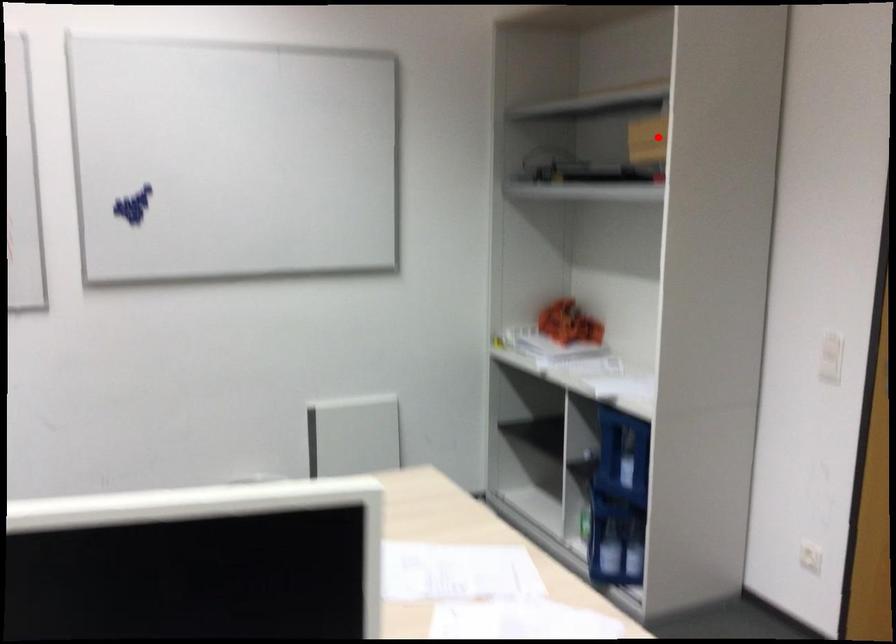
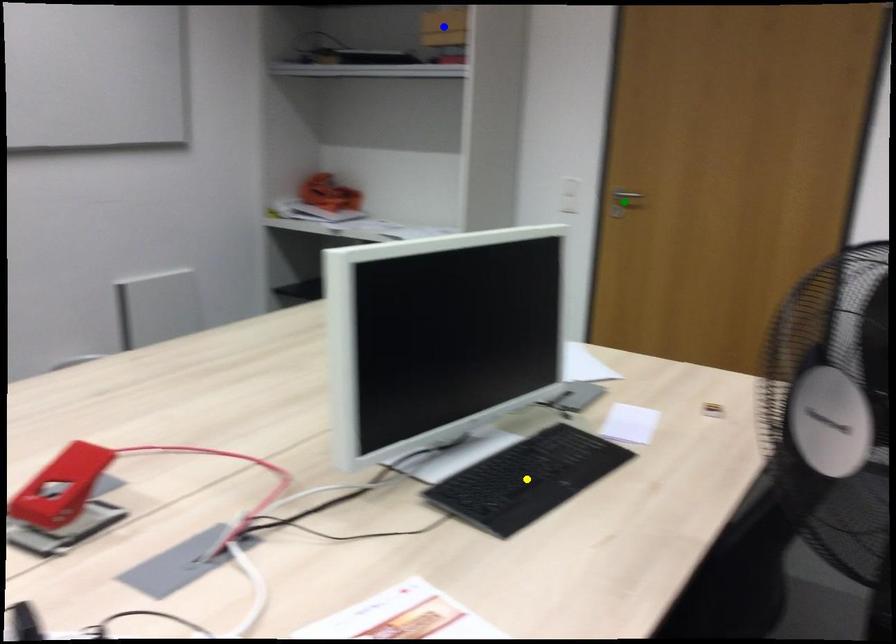
Question: I am providing you with two images of the same scene from different viewpoints. A red point is marked on the first image. You are given multiple points on the second image. Which point in image 2 represents the same 3d spot as the red point in image 1?

Choices:
 (A) green point
 (B) yellow point
 (C) blue point

Answer: (C)